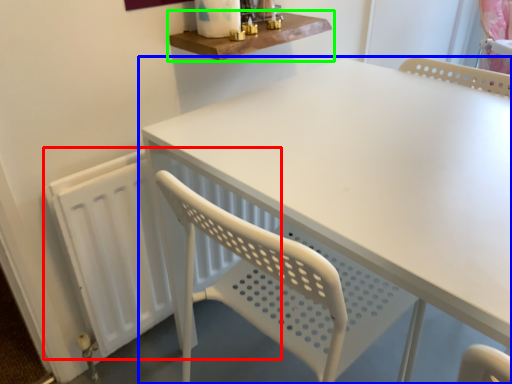
Question: Which object is the closest to the radiator (highlighted by a red box)? Choose among these: table (highlighted by a blue box) or shelf (highlighted by a green box).

Choices:
 (A) table
 (B) shelf

Answer: (A)